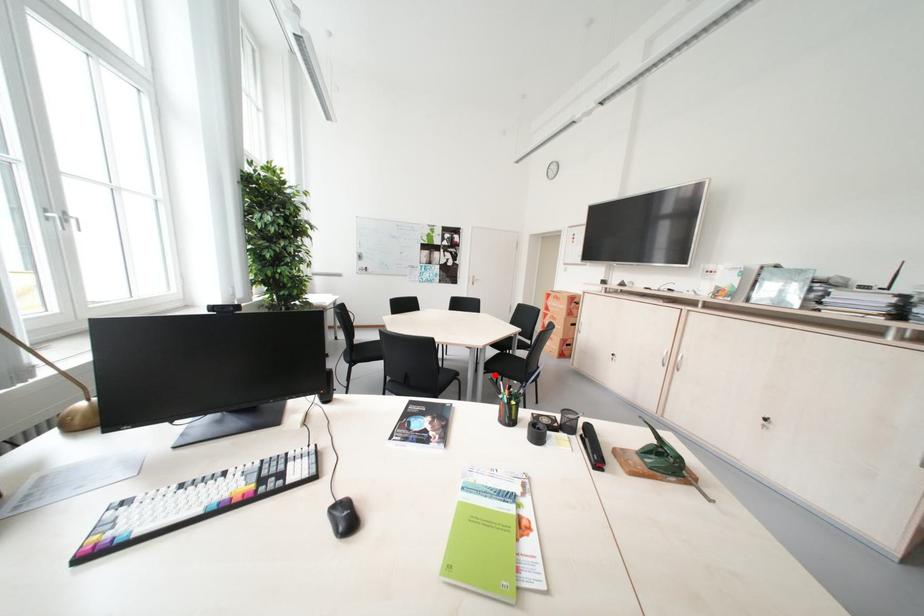
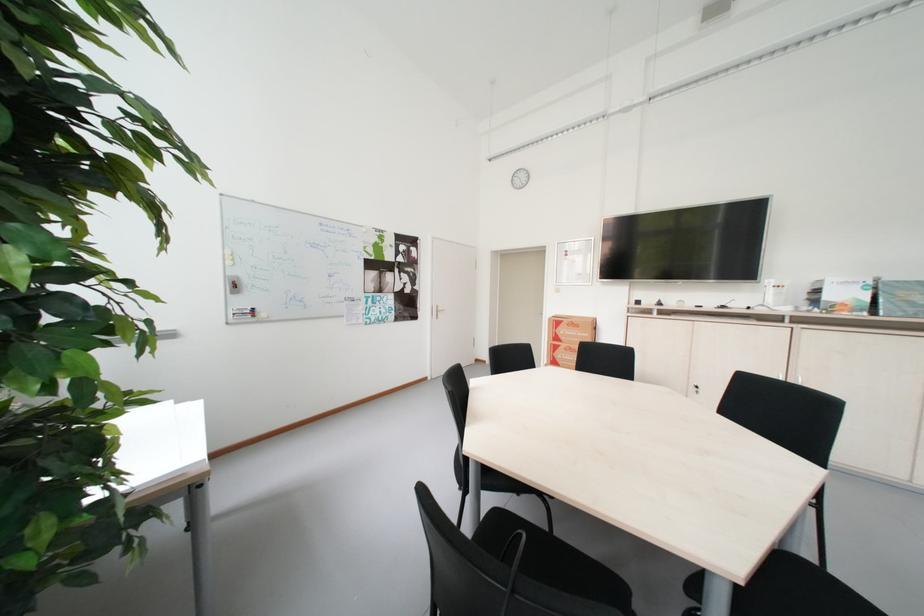
Question: I am providing you with two images of the same scene from different viewpoints. A red point is marked on the first image. At the location where the point appears in image 1, is it still visible in image 2?

Choices:
 (A) Yes
 (B) No

Answer: (B)